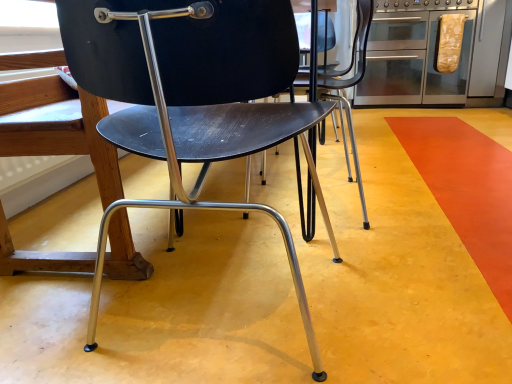
Question: Does point (151, 1) appear closer or farther from the camera than point (462, 89)?

Choices:
 (A) closer
 (B) farther

Answer: (A)

Question: In terms of size, does matte black chair at center appear bigger or smaller than metallic stainless steel oven at upper right?

Choices:
 (A) big
 (B) small

Answer: (B)

Question: Looking at their shapes, would you say matte black chair at center is wider or thinner than metallic stainless steel oven at upper right?

Choices:
 (A) thin
 (B) wide

Answer: (A)

Question: Is metallic stainless steel oven at upper right wider or thinner than matte black chair at center?

Choices:
 (A) wide
 (B) thin

Answer: (A)

Question: Which is correct: metallic stainless steel oven at upper right is inside matte black chair at center, or outside of it?

Choices:
 (A) inside
 (B) outside

Answer: (B)

Question: From a real-world perspective, relative to matte black chair at center, is metallic stainless steel oven at upper right vertically above or below?

Choices:
 (A) below
 (B) above

Answer: (B)

Question: Does point (412, 18) appear closer or farther from the camera than point (89, 72)?

Choices:
 (A) farther
 (B) closer

Answer: (A)